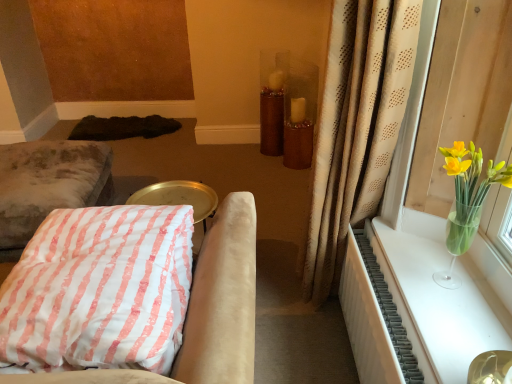
The width and height of the screenshot is (512, 384). Find the location of `free space in front of translucent glass vase at upper right`. free space in front of translucent glass vase at upper right is located at coordinates (460, 322).